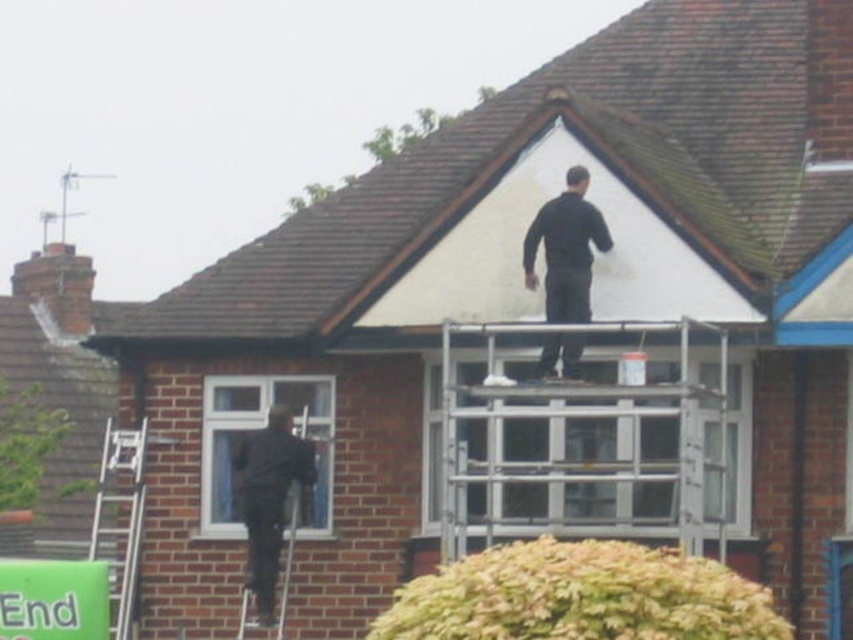
Question: Among these objects, which one is nearest to the camera?

Choices:
 (A) white matte roof at upper center
 (B) metallic silver ladder at left
 (C) silver metallic scaffolding at upper center

Answer: (C)

Question: Can you confirm if white matte roof at upper center is smaller than dark gray fabric jacket at lower left?

Choices:
 (A) no
 (B) yes

Answer: (A)

Question: From the image, what is the correct spatial relationship of dark gray fabric jacket at lower left in relation to metallic silver ladder at left?

Choices:
 (A) right
 (B) left

Answer: (A)

Question: Which object is positioned farthest from the dark gray fabric jacket at lower left?

Choices:
 (A) red brick chimney at upper left
 (B) black matte jacket at upper center
 (C) metallic silver ladder at left

Answer: (A)

Question: Which of these objects is positioned farthest from the white matte roof at upper center?

Choices:
 (A) red brick chimney at upper left
 (B) dark gray fabric jacket at lower left
 (C) black matte jacket at upper center

Answer: (A)

Question: Does dark gray fabric jacket at lower left lie behind metallic silver ladder at left?

Choices:
 (A) yes
 (B) no

Answer: (B)